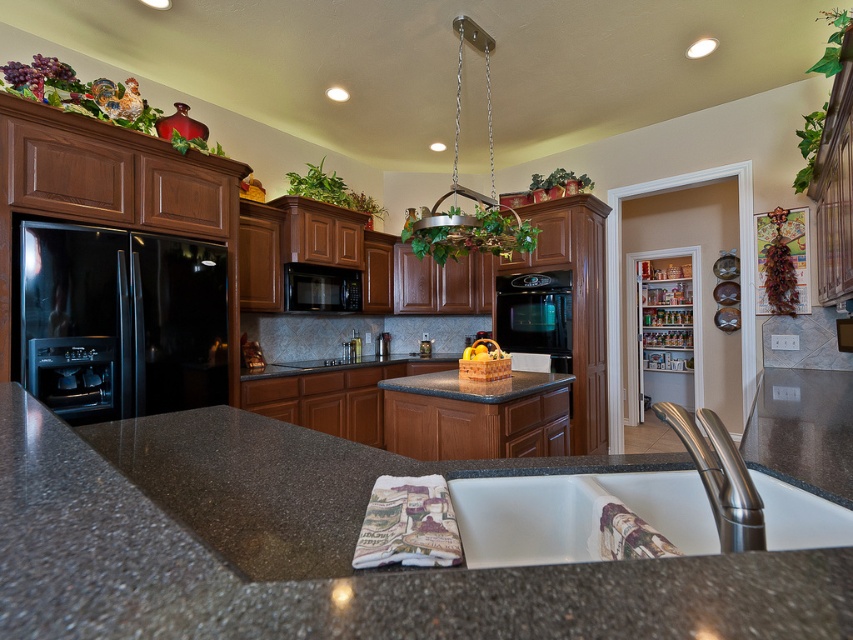
Is granite at center bigger than black matte microwave at center?

Yes.

Between granite at center and black matte microwave at center, which one has more height?

With more height is black matte microwave at center.

Is point (230, 465) positioned behind point (299, 282)?

No, it is not.

Identify the location of granite at center. (322, 547).

Which is more to the left, granite at center or white ceramic sink at lower center?

white ceramic sink at lower center is more to the left.

Identify the location of granite at center. The height and width of the screenshot is (640, 853). (322, 547).

Where is `granite at center`? granite at center is located at coordinates (322, 547).

At what (x,y) coordinates should I click in order to perform the action: click on granite at center. Please return your answer as a coordinate pair (x, y). The height and width of the screenshot is (640, 853). Looking at the image, I should click on (322, 547).

Between point (848, 604) and point (45, 236), which one is positioned in front?

Point (848, 604)

In the scene shown: Who is more forward, (x=473, y=595) or (x=131, y=372)?

Positioned in front is point (x=473, y=595).

The image size is (853, 640). Identify the location of granite at center. (322, 547).